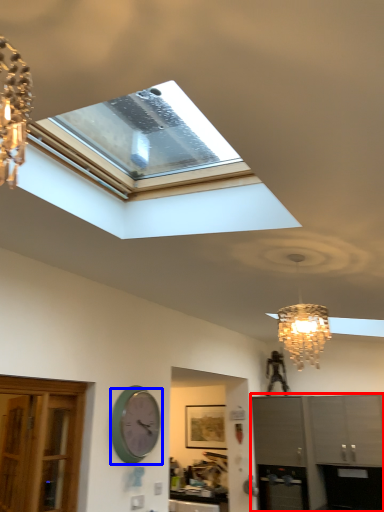
Question: Among these objects, which one is farthest to the camera, cabinetry (highlighted by a red box) or wall clock (highlighted by a blue box)?

Choices:
 (A) cabinetry
 (B) wall clock

Answer: (A)